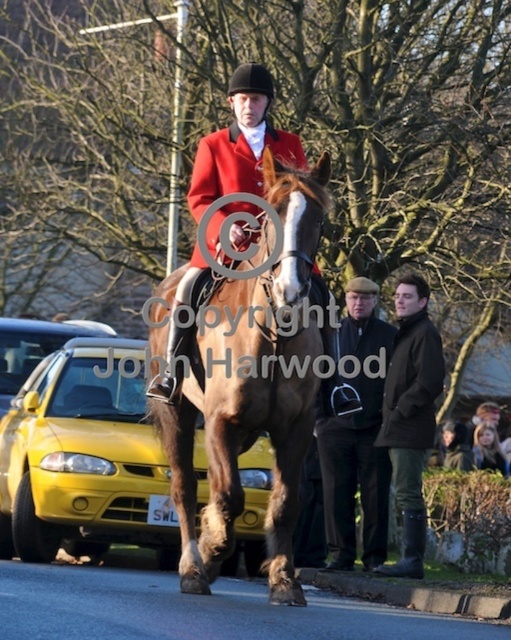
You are a photographer standing at the edge of the road. You want to take a photo of the matte red jacket at center and the dark brown leather jacket at lower right. Which jacket should you focus on first if you want to capture both in the same frame without moving your camera?

The matte red jacket at center is shorter than the dark brown leather jacket at lower right, so you should focus on the dark brown leather jacket at lower right first to ensure both are in frame.

You are a pedestrian standing at the blonde hair at center position. There is a yellow matte taxi at left that is approaching. If the taxi is moving at 5 meters per second, how many seconds will it take for the taxi to reach you?

The distance between the yellow matte taxi at left and blonde hair at center is 8.63 meters. At a speed of 5 meters per second, the taxi will take approximately 1.73 seconds to reach the blonde hair at center position.